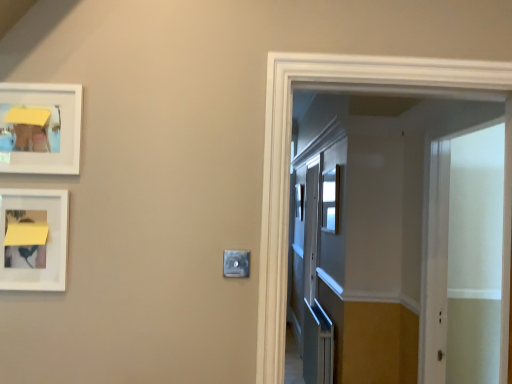
Question: Are white matte picture frame at left, marked as the 1th picture frame in a bottom-to-top arrangement, and satin silver switch at center beside each other?

Choices:
 (A) no
 (B) yes

Answer: (A)

Question: From the image's perspective, is white matte picture frame at left, which appears as the second picture frame when viewed from the top, over satin silver switch at center?

Choices:
 (A) no
 (B) yes

Answer: (B)

Question: Are white matte picture frame at left, which appears as the second picture frame when viewed from the top, and satin silver switch at center located far from each other?

Choices:
 (A) yes
 (B) no

Answer: (B)

Question: From a real-world perspective, is white matte picture frame at left, marked as the 1th picture frame in a bottom-to-top arrangement, over satin silver switch at center?

Choices:
 (A) no
 (B) yes

Answer: (B)

Question: Is white matte picture frame at left, marked as the 1th picture frame in a bottom-to-top arrangement, positioned before satin silver switch at center?

Choices:
 (A) yes
 (B) no

Answer: (A)

Question: Is clear glass window at center bigger or smaller than satin silver switch at center?

Choices:
 (A) small
 (B) big

Answer: (B)

Question: Is clear glass window at center taller or shorter than satin silver switch at center?

Choices:
 (A) short
 (B) tall

Answer: (B)

Question: Looking at their shapes, would you say clear glass window at center is wider or thinner than satin silver switch at center?

Choices:
 (A) wide
 (B) thin

Answer: (A)

Question: Relative to satin silver switch at center, is clear glass window at center in front or behind?

Choices:
 (A) front
 (B) behind

Answer: (B)

Question: From the image's perspective, is satin silver switch at center positioned above or below clear glass window at center?

Choices:
 (A) below
 (B) above

Answer: (A)

Question: From a real-world perspective, is satin silver switch at center positioned above or below clear glass window at center?

Choices:
 (A) above
 (B) below

Answer: (B)

Question: Considering their positions, is satin silver switch at center located in front of or behind clear glass window at center?

Choices:
 (A) front
 (B) behind

Answer: (A)

Question: Is satin silver switch at center inside the boundaries of clear glass window at center, or outside?

Choices:
 (A) inside
 (B) outside

Answer: (B)

Question: Considering the positions of satin silver switch at center and white translucent screen door at right in the image, is satin silver switch at center bigger or smaller than white translucent screen door at right?

Choices:
 (A) big
 (B) small

Answer: (B)

Question: Is satin silver switch at center inside the boundaries of white translucent screen door at right, or outside?

Choices:
 (A) inside
 (B) outside

Answer: (B)